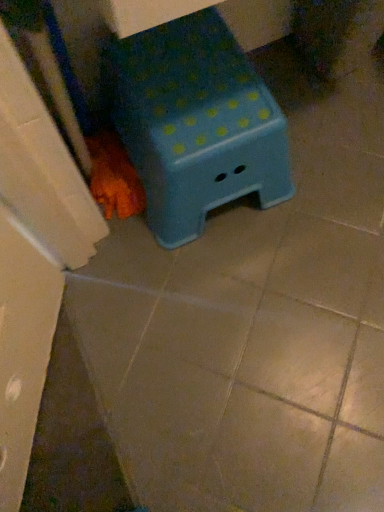
What are the coordinates of `vacant space to the right of blue plastic stool at center` in the screenshot? It's located at (329, 158).